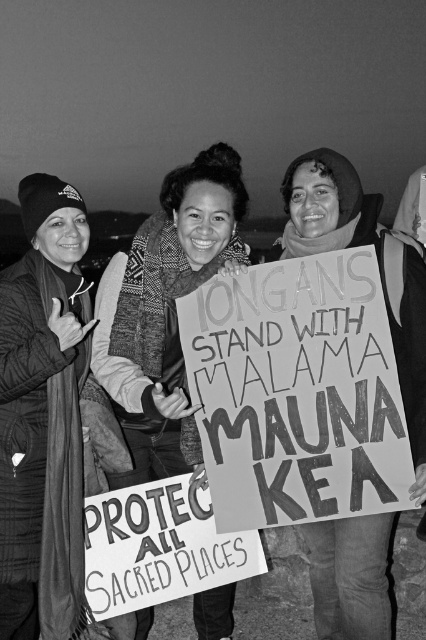
You are a photographer who wants to crop the image to focus on the plaid wool scarf at left. Given the coordinate system where the bottom left corner is the origin, can you confirm if the point at [43,419] is located in the upper half of the image?

The point at [43,419] corresponds to the plaid wool scarf at left. Since the y coordinate is 0.103, which is less than 0.5, the point is in the lower half of the image. Therefore, the plaid wool scarf at left is not in the upper half.

You are a photographer trying to capture the protest signs clearly in this nighttime scene. Given that the handwritten cardboard sign at center and the knitted scarf at center are both in your camera frame, which object should you focus on to ensure the text on the sign is legible?

The handwritten cardboard sign at center is smaller than the knitted scarf at center, so focusing on the smaller sign will require precise adjustment to ensure the text remains legible in the photograph.